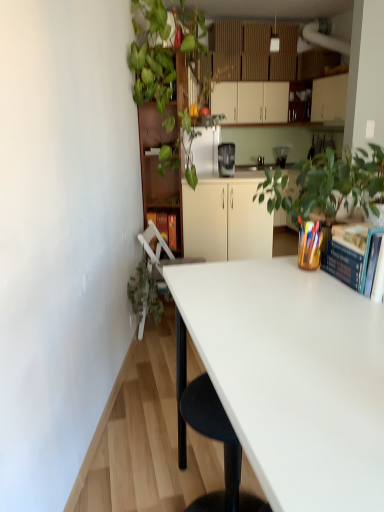
This screenshot has height=512, width=384. What do you see at coordinates (159, 253) in the screenshot?
I see `white plastic chair at lower left` at bounding box center [159, 253].

This screenshot has height=512, width=384. Describe the element at coordinates (226, 159) in the screenshot. I see `satin black coffee maker at center` at that location.

Measure the distance between point (167,94) and camera.

A distance of 9.48 feet exists between point (167,94) and camera.

Identify the location of brown wooden bookshelf at upper center. (157, 155).

This screenshot has width=384, height=512. What do you see at coordinates (225, 222) in the screenshot? I see `white matte cabinet at center, the second cabinetry when ordered from back to front` at bounding box center [225, 222].

I want to click on green leafy plant at lower left, the 1th vegetation positioned from the bottom, so click(x=144, y=292).

Which of these two, matte black coffee maker at center or white plastic chair at lower left, is smaller?

matte black coffee maker at center is smaller.

How distant is matte black coffee maker at center from white plastic chair at lower left?

matte black coffee maker at center is 9.56 feet from white plastic chair at lower left.

Which is behind, point (277, 153) or point (156, 234)?

The point (277, 153) is more distant.

Would you say matte black coffee maker at center is outside white plastic chair at lower left?

Yes, matte black coffee maker at center is located beyond the bounds of white plastic chair at lower left.

Looking at this image, between blue hardcover book at upper right and white matte cabinet at center, placed as the 2th cabinetry when sorted from top to bottom, which one is positioned behind?

white matte cabinet at center, placed as the 2th cabinetry when sorted from top to bottom, is further away from the camera.

Which of these two, blue hardcover book at upper right or white matte cabinet at center, placed as the 2th cabinetry when sorted from top to bottom, stands shorter?

Standing shorter between the two is blue hardcover book at upper right.

From a real-world perspective, who is located higher, blue hardcover book at upper right or white matte cabinet at center, the second cabinetry when ordered from back to front?

blue hardcover book at upper right is physically above.

Consider the image. Which of these two, blue hardcover book at upper right or white matte cabinet at center, which is the first cabinetry in front-to-back order, is bigger?

With larger size is white matte cabinet at center, which is the first cabinetry in front-to-back order.

Who is shorter, green leafy plant at upper left, arranged as the 1th vegetation when viewed from the top, or blue hardcover book at upper right?

blue hardcover book at upper right.

Would you say blue hardcover book at upper right is part of green leafy plant at upper left, arranged as the 1th vegetation when viewed from the top,'s contents?

No, blue hardcover book at upper right is not a part of green leafy plant at upper left, arranged as the 1th vegetation when viewed from the top.

Is green leafy plant at upper left, the 2th vegetation from the bottom, next to blue hardcover book at upper right?

No, green leafy plant at upper left, the 2th vegetation from the bottom, is not with blue hardcover book at upper right.

Can you confirm if blue hardcover book at upper right is bigger than white matte cabinet at upper center, which is counted as the 1th cabinetry, starting from the top?

No, blue hardcover book at upper right is not bigger than white matte cabinet at upper center, which is counted as the 1th cabinetry, starting from the top.

From a real-world perspective, is blue hardcover book at upper right above or below white matte cabinet at upper center, which is counted as the 1th cabinetry, starting from the top?

Clearly, from a real-world perspective, blue hardcover book at upper right is below white matte cabinet at upper center, which is counted as the 1th cabinetry, starting from the top.

Is blue hardcover book at upper right positioned with its back to white matte cabinet at upper center, which is counted as the 1th cabinetry, starting from the top?

blue hardcover book at upper right is not turned away from white matte cabinet at upper center, which is counted as the 1th cabinetry, starting from the top.

From a real-world perspective, is green leafy plant at lower left, the 1th vegetation positioned from the bottom, on hardcover book at center?

Incorrect, from a real-world perspective, green leafy plant at lower left, the 1th vegetation positioned from the bottom, is lower than hardcover book at center.

Between green leafy plant at lower left, which is counted as the second vegetation, starting from the top, and hardcover book at center, which one appears on the right side from the viewer's perspective?

hardcover book at center is more to the right.

Can you confirm if green leafy plant at lower left, which is counted as the second vegetation, starting from the top, is bigger than hardcover book at center?

Yes.

Which object is wider, green leafy plant at lower left, which is counted as the second vegetation, starting from the top, or hardcover book at center?

green leafy plant at lower left, which is counted as the second vegetation, starting from the top.

Considering the positions of point (324, 452) and point (279, 153), is point (324, 452) closer or farther from the camera than point (279, 153)?

Point (324, 452) is positioned closer to the camera compared to point (279, 153).

Is white glossy desk at center in front of or behind matte black coffee maker at center in the image?

Visually, white glossy desk at center is located in front of matte black coffee maker at center.

Consider the image. How far apart are white glossy desk at center and matte black coffee maker at center?

4.40 meters.

Between white glossy desk at center and matte black coffee maker at center, which one has smaller width?

Thinner between the two is matte black coffee maker at center.

Considering the relative sizes of matte black coffee maker at center and green leafy plant at upper left, arranged as the 1th vegetation when viewed from the top, in the image provided, is matte black coffee maker at center bigger than green leafy plant at upper left, arranged as the 1th vegetation when viewed from the top,?

No, matte black coffee maker at center is not bigger than green leafy plant at upper left, arranged as the 1th vegetation when viewed from the top.

Does point (283, 149) come behind point (160, 63)?

Yes.

Looking at this image, which object is positioned more to the left, matte black coffee maker at center or green leafy plant at upper left, arranged as the 1th vegetation when viewed from the top?

From the viewer's perspective, green leafy plant at upper left, arranged as the 1th vegetation when viewed from the top, appears more on the left side.

Which vegetation is the 1st one when counting from the front of the matte black coffee maker at center? Please provide its 2D coordinates.

[(152, 56)]

This screenshot has height=512, width=384. What are the coordinates of `appliance above the white plastic chair at lower left (from the image's perspective)` in the screenshot? It's located at (281, 155).

Where is `cabinetry directly beneath the blue hardcover book at upper right (from a real-world perspective)`? This screenshot has height=512, width=384. cabinetry directly beneath the blue hardcover book at upper right (from a real-world perspective) is located at coordinates (225, 222).

From the image, which object appears to be nearer to green leafy plant at lower left, the 1th vegetation positioned from the bottom, satin black coffee maker at center or white matte cabinet at center, positioned as the 1th cabinetry in bottom-to-top order?

white matte cabinet at center, positioned as the 1th cabinetry in bottom-to-top order, is closer to green leafy plant at lower left, the 1th vegetation positioned from the bottom.

When comparing their distances from green leafy plant at upper left, the 2th vegetation from the bottom, does blue hardcover book at upper right or white glossy desk at center seem closer?

blue hardcover book at upper right is closer to green leafy plant at upper left, the 2th vegetation from the bottom.

From the image, which object appears to be farther from white plastic chair at lower left, blue hardcover book at upper right or brown wooden bookshelf at upper center?

blue hardcover book at upper right lies further to white plastic chair at lower left than the other object.

When comparing their distances from matte black coffee maker at center, does white matte cabinet at upper center, which is counted as the 1th cabinetry, starting from the top, or green leafy plant at lower left, the 1th vegetation positioned from the bottom, seem closer?

white matte cabinet at upper center, which is counted as the 1th cabinetry, starting from the top, is closer to matte black coffee maker at center.

When comparing their distances from white matte cabinet at upper center, which is counted as the 1th cabinetry, starting from the top, does green leafy plant at lower left, which is counted as the second vegetation, starting from the top, or blue hardcover book at upper right seem closer?

green leafy plant at lower left, which is counted as the second vegetation, starting from the top, lies closer to white matte cabinet at upper center, which is counted as the 1th cabinetry, starting from the top, than the other object.

Which object lies nearer to the anchor point white plastic chair at lower left, green leafy plant at lower left, which is counted as the second vegetation, starting from the top, or hardcover book at center?

green leafy plant at lower left, which is counted as the second vegetation, starting from the top, is closer to white plastic chair at lower left.

Based on their spatial positions, is white plastic chair at lower left or green leafy plant at lower left, which is counted as the second vegetation, starting from the top, closer to brown wooden bookshelf at upper center?

Among the two, white plastic chair at lower left is located nearer to brown wooden bookshelf at upper center.

Based on their spatial positions, is green leafy plant at upper left, the 2th vegetation from the bottom, or white plastic chair at lower left further from blue hardcover book at upper right?

green leafy plant at upper left, the 2th vegetation from the bottom.

Identify the location of bookshelf positioned between green leafy plant at lower left, which is counted as the second vegetation, starting from the top, and matte black coffee maker at center from near to far. (157, 155).

You are a GUI agent. You are given a task and a screenshot of the screen. Output one action in this format:
    pyautogui.click(x=<x>, y=<y>)
    Task: Click on the book positioned between green leafy plant at lower left, the 1th vegetation positioned from the bottom, and white matte cabinet at upper center, marked as the 2th cabinetry in a front-to-back arrangement, from near to far
    
    Given the screenshot: What is the action you would take?
    pyautogui.click(x=150, y=220)

Locate an element on the screen. The image size is (384, 512). chair between green leafy plant at lower left, the 1th vegetation positioned from the bottom, and hardcover book at center, along the z-axis is located at coordinates (159, 253).

Find the location of a particular element. bookshelf positioned between green leafy plant at upper left, the 2th vegetation from the bottom, and matte black coffee maker at center from near to far is located at coordinates (157, 155).